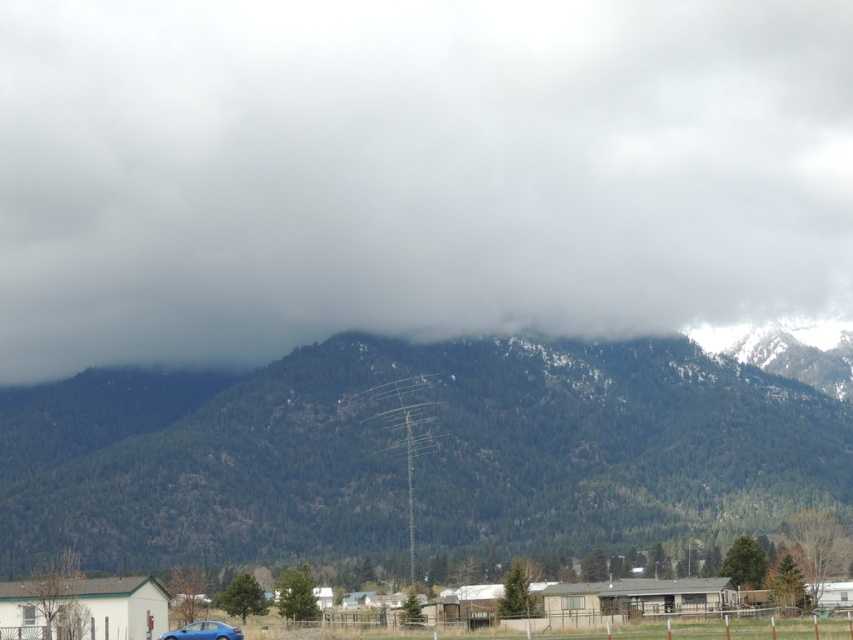
Can you confirm if white fluffy cloud at upper center is shorter than green forested mountain at center?

In fact, white fluffy cloud at upper center may be taller than green forested mountain at center.

Who is taller, white fluffy cloud at upper center or green forested mountain at center?

Standing taller between the two is white fluffy cloud at upper center.

Which is behind, point (56, 116) or point (218, 408)?

Positioned behind is point (56, 116).

Identify the location of white fluffy cloud at upper center. (415, 173).